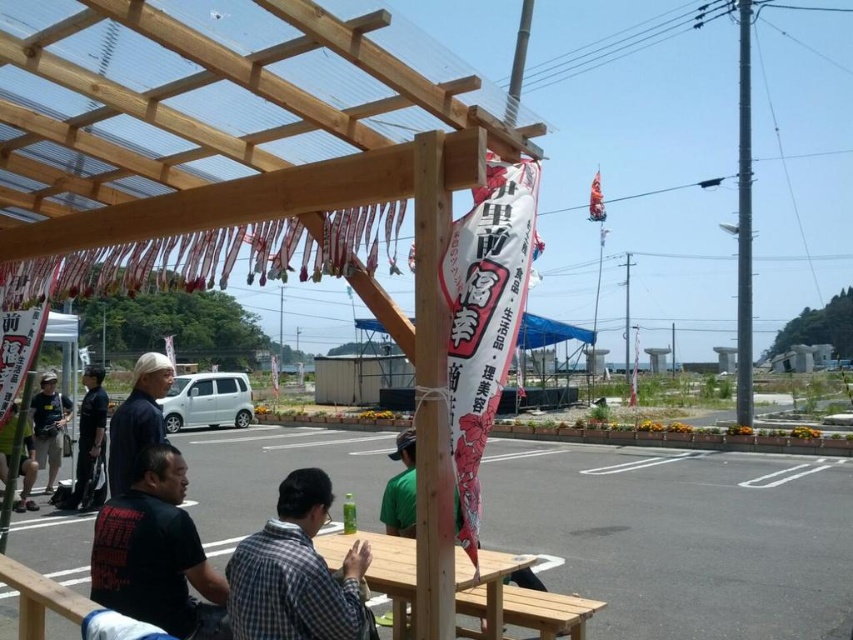
Does dark brown fabric cap at upper left have a smaller size compared to dark blue uniform at left?

Correct, dark brown fabric cap at upper left occupies less space than dark blue uniform at left.

Which is below, dark brown fabric cap at upper left or dark blue uniform at left?

Positioned lower is dark blue uniform at left.

What do you see at coordinates (137, 419) in the screenshot? The image size is (853, 640). I see `dark brown fabric cap at upper left` at bounding box center [137, 419].

At what (x,y) coordinates should I click in order to perform the action: click on dark brown fabric cap at upper left. Please return your answer as a coordinate pair (x, y). Image resolution: width=853 pixels, height=640 pixels. Looking at the image, I should click on (137, 419).

Does black cotton shirt at lower left have a greater width compared to green fabric shirt at center?

Correct, the width of black cotton shirt at lower left exceeds that of green fabric shirt at center.

Which of these two, black cotton shirt at lower left or green fabric shirt at center, stands taller?

With more height is black cotton shirt at lower left.

Which is in front, point (196, 577) or point (405, 490)?

Positioned in front is point (196, 577).

Locate an element on the screen. This screenshot has width=853, height=640. black cotton shirt at lower left is located at coordinates (x=155, y=554).

Who is more distant from viewer, (x=280, y=616) or (x=163, y=364)?

Point (x=163, y=364)

Between checkered shirt at center and dark brown fabric cap at upper left, which one has less height?

checkered shirt at center

Image resolution: width=853 pixels, height=640 pixels. Describe the element at coordinates (294, 572) in the screenshot. I see `checkered shirt at center` at that location.

Where is `checkered shirt at center`? The height and width of the screenshot is (640, 853). checkered shirt at center is located at coordinates (294, 572).